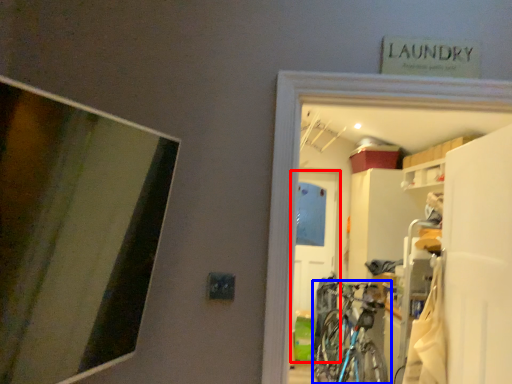
Question: Which of the following is the closest to the observer, door (highlighted by a red box) or bicycle (highlighted by a blue box)?

Choices:
 (A) door
 (B) bicycle

Answer: (B)